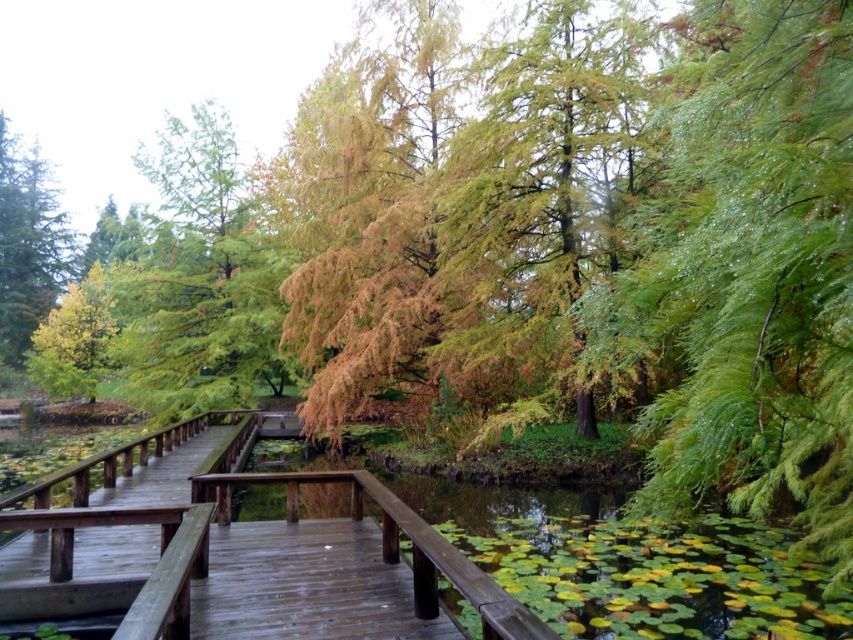
You are a hiker standing on the wooden boardwalk and want to cross the wooden bridge at center. The green glossy leaves at right are blocking your path. Can you walk around them?

The green glossy leaves at right are 11.64 feet away from the wooden bridge at center, so you can walk around them as they are not too close to the bridge.